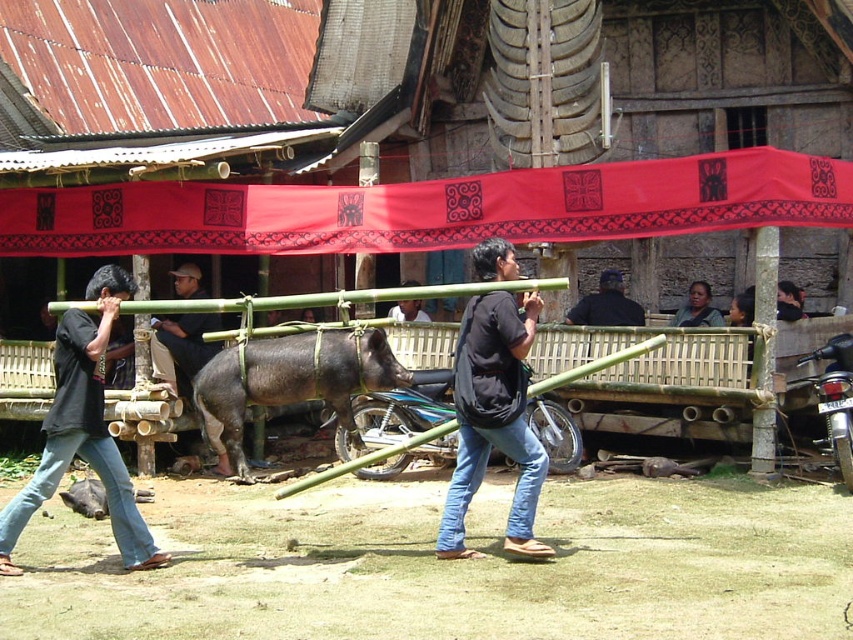
Where is the black shirt at center located in the image?

The black shirt at center is located at point 0.672 in the x coordinate and 0.098 in the y coordinate.

You are a photographer trying to capture a clear shot of the dark brown skin at center and the dark brown leather cap at upper center. Which object should you focus on first if you want to ensure both are in focus without adjusting your camera settings?

The dark brown skin at center should be focused on first because the dark brown leather cap at upper center is below it, meaning they are at different distances. By focusing on the closer object, the dark brown leather cap at upper center, you might lose focus on the farther dark brown skin at center. However, since the cap is below the skin, they might be on the same plane. Wait, the description says the cap is below the skin. That implies the skin is above, so the cap is closer to the camera. To get both,